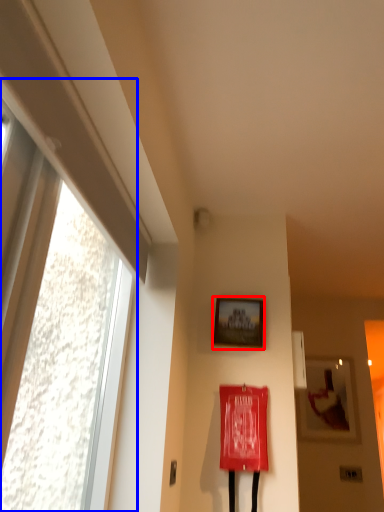
Question: Which object appears farthest to the camera in this image, picture frame (highlighted by a red box) or window (highlighted by a blue box)?

Choices:
 (A) picture frame
 (B) window

Answer: (A)